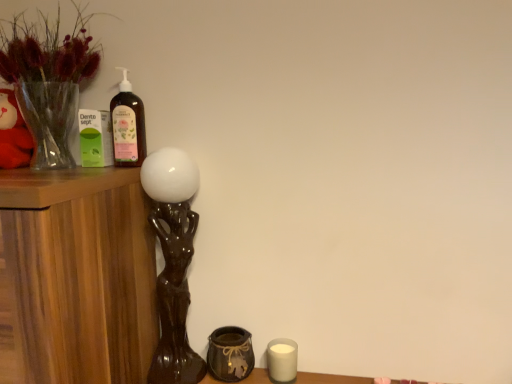
Question: Is translucent glass bottle at upper left further to the viewer compared to brown textured vase at lower center?

Choices:
 (A) no
 (B) yes

Answer: (A)

Question: From a real-world perspective, is translucent glass bottle at upper left located beneath brown textured vase at lower center?

Choices:
 (A) no
 (B) yes

Answer: (A)

Question: Can you confirm if translucent glass bottle at upper left is shorter than brown textured vase at lower center?

Choices:
 (A) yes
 (B) no

Answer: (B)

Question: Is translucent glass bottle at upper left next to brown textured vase at lower center?

Choices:
 (A) no
 (B) yes

Answer: (A)

Question: From the image's perspective, is translucent glass bottle at upper left under brown textured vase at lower center?

Choices:
 (A) yes
 (B) no

Answer: (B)

Question: Is brown textured vase at lower center inside translucent glass bottle at upper left?

Choices:
 (A) no
 (B) yes

Answer: (A)

Question: Does translucent glass bottle at upper left appear on the right side of white matte candle at lower right?

Choices:
 (A) yes
 (B) no

Answer: (B)

Question: Is translucent glass bottle at upper left wider than white matte candle at lower right?

Choices:
 (A) no
 (B) yes

Answer: (A)

Question: Is translucent glass bottle at upper left positioned before white matte candle at lower right?

Choices:
 (A) yes
 (B) no

Answer: (A)

Question: Does translucent glass bottle at upper left turn towards white matte candle at lower right?

Choices:
 (A) no
 (B) yes

Answer: (A)

Question: From a real-world perspective, is translucent glass bottle at upper left physically below white matte candle at lower right?

Choices:
 (A) no
 (B) yes

Answer: (A)

Question: From a real-world perspective, is translucent glass bottle at upper left on white matte candle at lower right?

Choices:
 (A) no
 (B) yes

Answer: (B)

Question: Considering the relative positions of translucent glass bottle at upper left and translucent glass vase at upper left in the image provided, is translucent glass bottle at upper left in front of translucent glass vase at upper left?

Choices:
 (A) no
 (B) yes

Answer: (A)